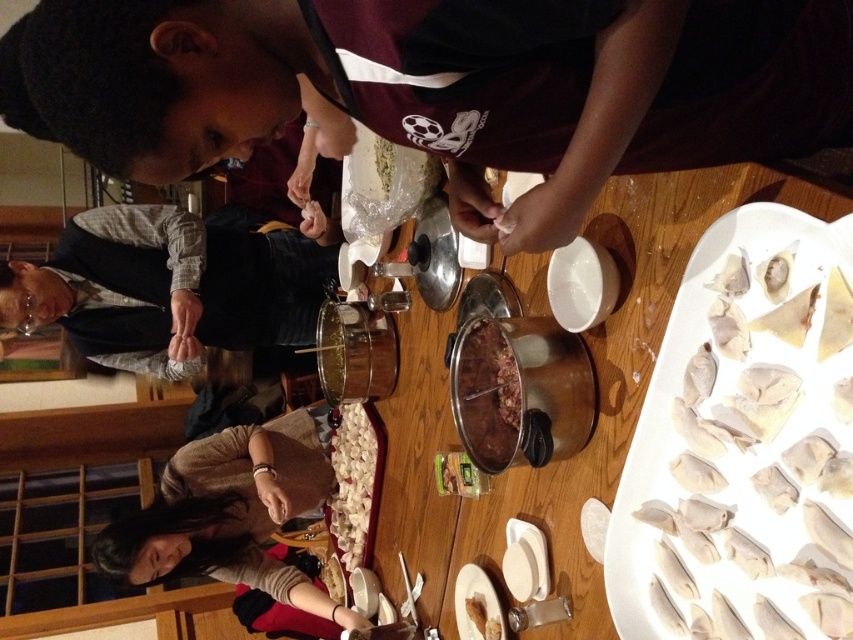
Locate an element on the screen. This screenshot has height=640, width=853. gray fabric shirt at lower left is located at coordinates (167, 288).

Consider the image. Between gray fabric shirt at lower left and white matte plate at lower center, which one appears on the left side from the viewer's perspective?

gray fabric shirt at lower left is more to the left.

At what (x,y) coordinates should I click in order to perform the action: click on gray fabric shirt at lower left. Please return your answer as a coordinate pair (x, y). Looking at the image, I should click on (167, 288).

The height and width of the screenshot is (640, 853). Describe the element at coordinates (743, 445) in the screenshot. I see `white paper platter at right` at that location.

Is white paper platter at right wider than gray fabric shirt at lower left?

No, white paper platter at right is not wider than gray fabric shirt at lower left.

Does point (813, 444) come in front of point (271, 312)?

Yes, it is in front of point (271, 312).

Locate an element on the screen. This screenshot has width=853, height=640. white paper platter at right is located at coordinates click(743, 445).

Find the location of a particular element. maroon jersey at upper center is located at coordinates (445, 88).

Is maroon jersey at upper center taller than white matte dumplings at center?

In fact, maroon jersey at upper center may be shorter than white matte dumplings at center.

The height and width of the screenshot is (640, 853). Identify the location of maroon jersey at upper center. (445, 88).

Identify the location of maroon jersey at upper center. (445, 88).